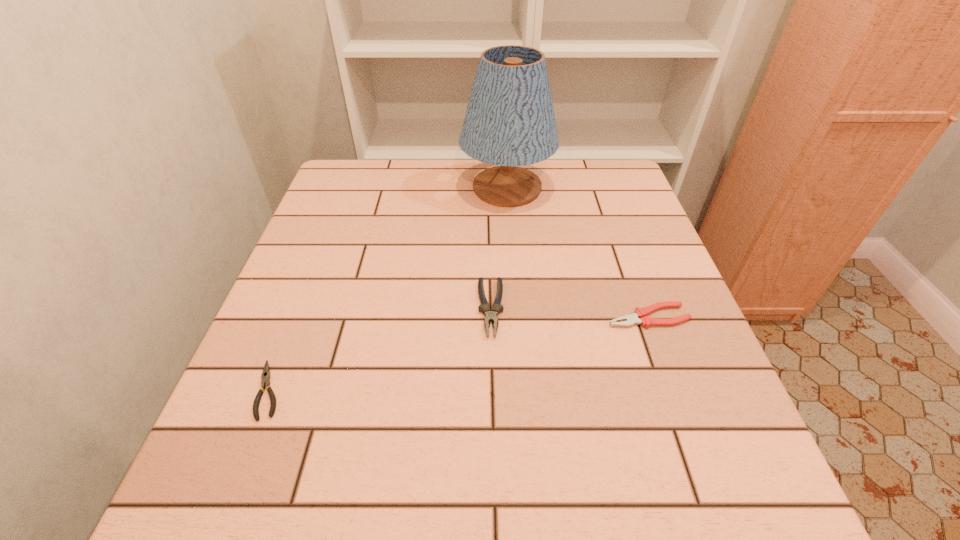
The width and height of the screenshot is (960, 540). Find the location of `vacant space at the near left corner`. vacant space at the near left corner is located at coordinates (231, 516).

Identify the location of vacant space at the far right corner of the desktop. (581, 180).

The width and height of the screenshot is (960, 540). Identify the location of vacant region at the near right corner. (708, 495).

This screenshot has width=960, height=540. In order to click on free space between the shortest object and the third shortest object in this screenshot , I will do `click(380, 349)`.

The height and width of the screenshot is (540, 960). In order to click on blank region between the farthest object and the leftmost pliers in this screenshot , I will do `click(388, 289)`.

At what (x,y) coordinates should I click in order to perform the action: click on vacant area that lies between the farthest object and the third tallest object. Please return your answer as a coordinate pair (x, y). This screenshot has height=540, width=960. Looking at the image, I should click on (577, 252).

Identify the location of vacant area that lies between the lampshade and the nearest pliers. (388, 289).

Locate an element on the screen. Image resolution: width=960 pixels, height=540 pixels. free space that is in between the nearest pliers and the lampshade is located at coordinates (388, 289).

Where is `vacant space that is in between the leftmost object and the rightmost object`? vacant space that is in between the leftmost object and the rightmost object is located at coordinates click(459, 353).

Where is `vacant area between the rightmost pliers and the farthest object`? This screenshot has height=540, width=960. vacant area between the rightmost pliers and the farthest object is located at coordinates (577, 252).